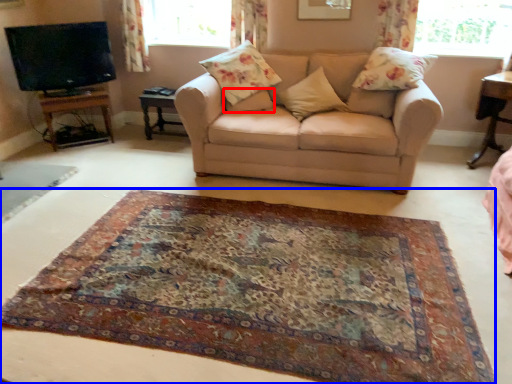
Question: Which object is closer to the camera taking this photo, pillow (highlighted by a red box) or mat (highlighted by a blue box)?

Choices:
 (A) pillow
 (B) mat

Answer: (B)